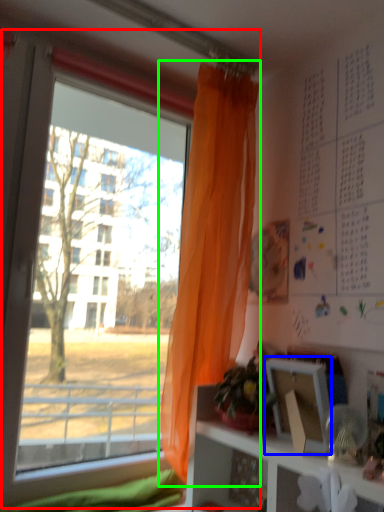
Question: Which object is positioned farthest from window (highlighted by a red box)? Select from picture frame (highlighted by a blue box) and curtain (highlighted by a green box).

Choices:
 (A) picture frame
 (B) curtain

Answer: (A)